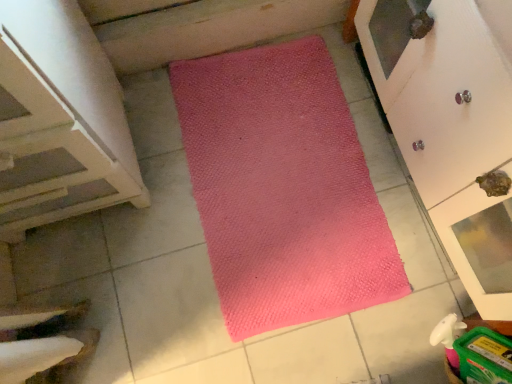
Locate an element on the screen. vacant area situated to the left side of pink textured mat at center is located at coordinates (128, 210).